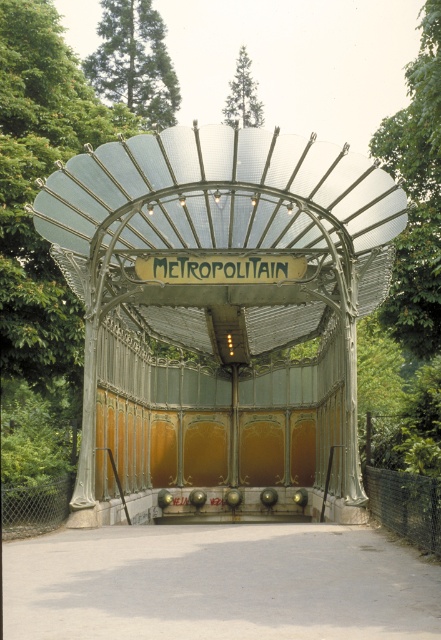
Is green leafy tree at upper right shorter than gold metallic sign at center?

In fact, green leafy tree at upper right may be taller than gold metallic sign at center.

Is point (392, 282) in front of point (154, 262)?

No, it is not.

Between point (432, 19) and point (299, 260), which one is positioned in front?

Point (299, 260) is in front.

Identify the location of green leafy tree at upper right. This screenshot has height=640, width=441. (417, 195).

Does green leafy tree at upper left have a greater height compared to green leafy tree at upper center?

Indeed, green leafy tree at upper left has a greater height compared to green leafy tree at upper center.

Which is below, green leafy tree at upper left or green leafy tree at upper center?

green leafy tree at upper left is below.

Is point (119, 99) more distant than point (235, 99)?

No, (119, 99) is closer to viewer.

Locate an element on the screen. green leafy tree at upper left is located at coordinates (134, 61).

Who is more forward, (436, 250) or (245, 120)?

Positioned in front is point (436, 250).

I want to click on green leafy tree at upper right, so click(x=417, y=195).

Measure the distance between green leafy tree at upper right and camera.

They are 17.63 meters apart.

At what (x,y) coordinates should I click in order to perform the action: click on green leafy tree at upper right. Please return your answer as a coordinate pair (x, y). Looking at the image, I should click on (417, 195).